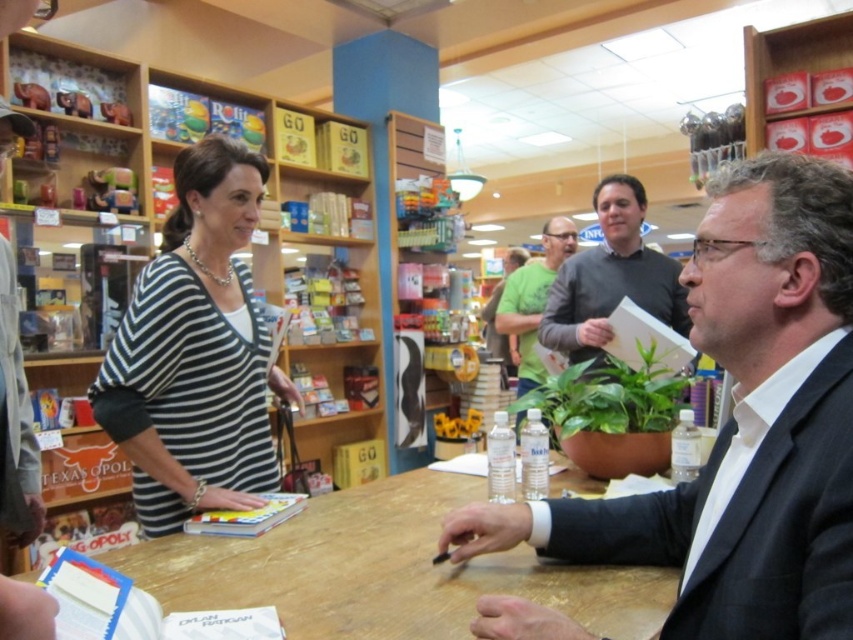
Question: Does wooden shelves at upper left appear on the right side of striped knit sweater at center?

Choices:
 (A) yes
 (B) no

Answer: (B)

Question: Which point appears farthest from the camera in this image?

Choices:
 (A) (247, 284)
 (B) (502, 292)
 (C) (151, 484)

Answer: (B)

Question: Is wooden table at center to the left of striped knit sweater at center from the viewer's perspective?

Choices:
 (A) no
 (B) yes

Answer: (A)

Question: Which point appears closest to the camera in this image?

Choices:
 (A) (405, 602)
 (B) (251, 154)

Answer: (A)

Question: Does striped knit sweater at center come behind gray sweater at center?

Choices:
 (A) no
 (B) yes

Answer: (A)

Question: Among these points, which one is nearest to the camera?

Choices:
 (A) (824, 419)
 (B) (138, 406)

Answer: (A)